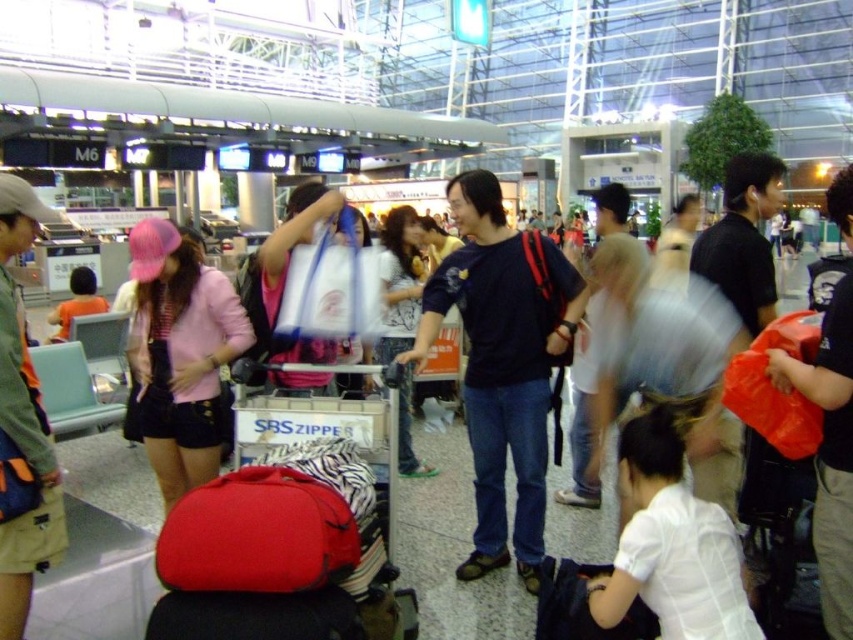
Question: Considering the real-world distances, which object is farthest from the white matte shirt at lower center?

Choices:
 (A) denim jeans at center
 (B) pink knitted hat at left

Answer: (B)

Question: Which of the following is the closest to the observer?

Choices:
 (A) (148, 458)
 (B) (401, 412)
 (C) (656, 499)

Answer: (C)

Question: Is pink knitted hat at left above white matte shirt at lower center?

Choices:
 (A) no
 (B) yes

Answer: (B)

Question: Can you confirm if pink knitted hat at left is positioned to the right of denim jeans at center?

Choices:
 (A) yes
 (B) no

Answer: (B)

Question: From the image, what is the correct spatial relationship of pink knitted hat at left in relation to white matte shirt at lower center?

Choices:
 (A) left
 (B) right

Answer: (A)

Question: Based on their relative distances, which object is farther from the denim jeans at center?

Choices:
 (A) white matte shirt at lower center
 (B) pink knitted hat at left

Answer: (A)